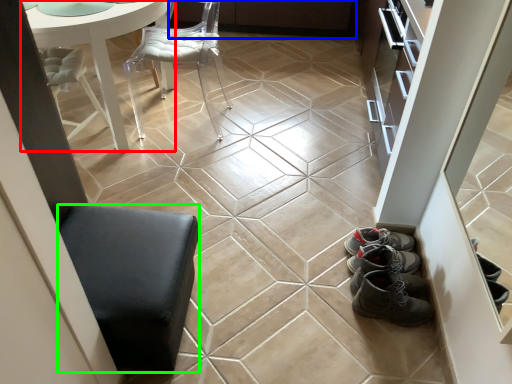
Question: Which object is positioned farthest from table (highlighted by a red box)? Select from cabinetry (highlighted by a blue box) and furniture (highlighted by a green box).

Choices:
 (A) cabinetry
 (B) furniture

Answer: (A)